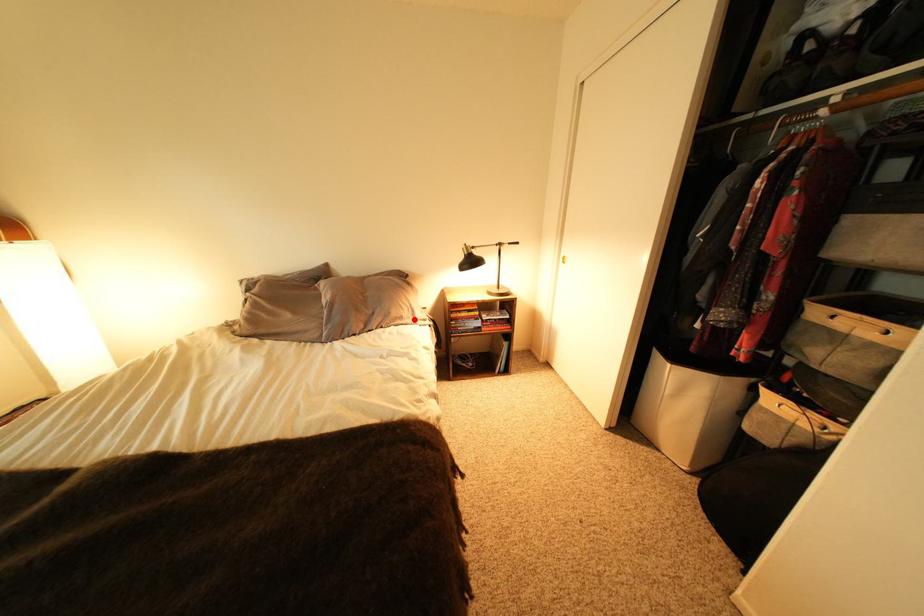
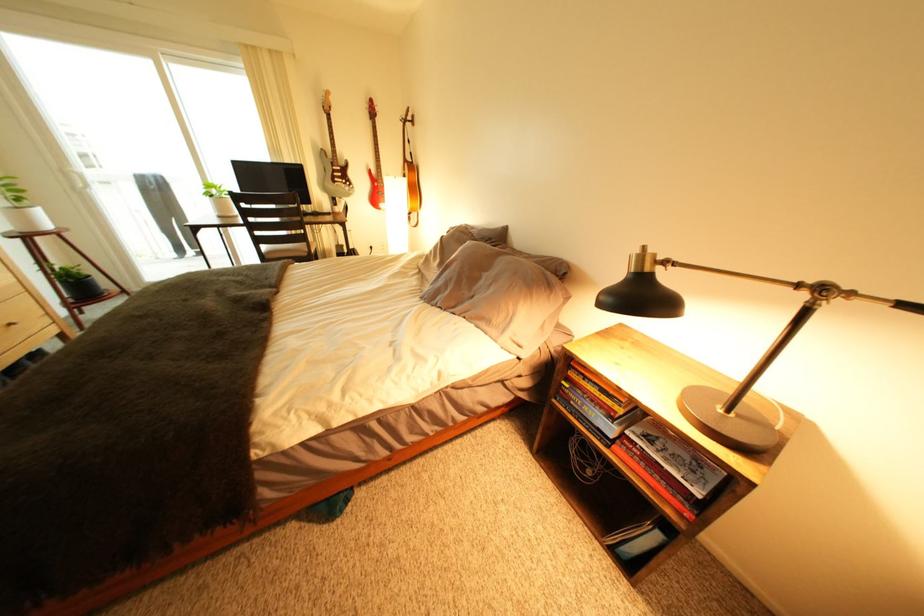
Question: I am providing you with two images of the same scene from different viewpoints. A red point is shown in image1. For the corresponding object point in image2, is it positioned nearer or farther from the camera?

Choices:
 (A) Nearer
 (B) Farther

Answer: (B)